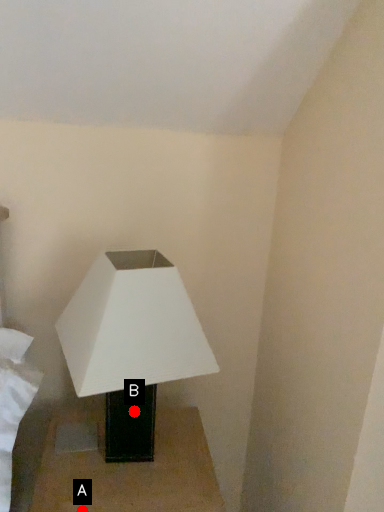
Question: Two points are circled on the image, labeled by A and B beside each circle. Which point appears closest to the camera in this image?

Choices:
 (A) A is closer
 (B) B is closer

Answer: (A)